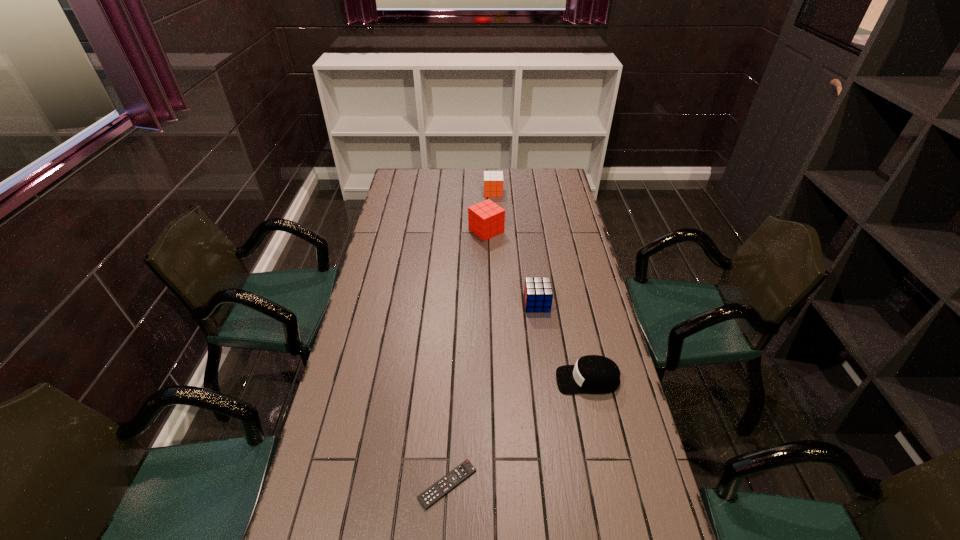
Where is `vacant space at the far left corner of the desktop`? The image size is (960, 540). vacant space at the far left corner of the desktop is located at coordinates (408, 188).

Image resolution: width=960 pixels, height=540 pixels. Identify the location of free region at the far right corner of the desktop. (555, 188).

Find the location of a particular element. vacant space that is in between the remote control and the second nearest object is located at coordinates (517, 432).

The width and height of the screenshot is (960, 540). I want to click on vacant space that's between the nearest object and the second nearest cube, so click(x=467, y=357).

What are the coordinates of `empty space that is in between the fourth farthest object and the remote control` in the screenshot? It's located at coord(517,432).

Find the location of `free space between the farthest object and the third nearest object`. free space between the farthest object and the third nearest object is located at coordinates (515, 248).

The height and width of the screenshot is (540, 960). In order to click on free space that is in between the farthest cube and the nearest object in this screenshot , I will do `click(470, 338)`.

This screenshot has height=540, width=960. Identify the location of vacant space that's between the rightmost cube and the farthest object. (515, 248).

I want to click on free point between the farthest cube and the rightmost cube, so click(515, 248).

Locate an element on the screen. This screenshot has width=960, height=540. object that is the closest to the second farthest object is located at coordinates (493, 180).